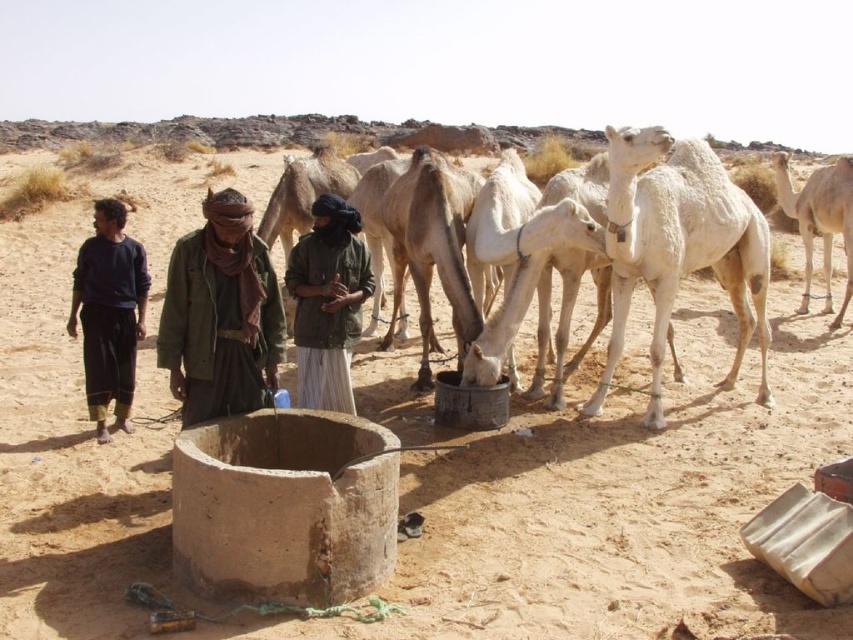
You are a traveler in the desert and notice the brown fabric headscarf at center and the white matte camel at right. Which object is positioned lower in the scene?

The brown fabric headscarf at center is below the white matte camel at right, so it is positioned lower in the scene.

You are a traveler in the desert and see the green fabric headscarf at center near the well. You need to retrieve it but have a 4.5 meter long stick. Can you reach it without moving closer?

The distance between you and the green fabric headscarf at center is 4.59 meters. Since your stick is only 4.5 meters long, you cannot reach it without moving closer.

You are a traveler in the desert and see two points marked on the ground. One is at point (309,337) and the other at point (785,202). If you are facing north, which point is closer to you?

Point (309,337) is in front of point (785,202), so if you are facing north, point (309,337) is closer to you.